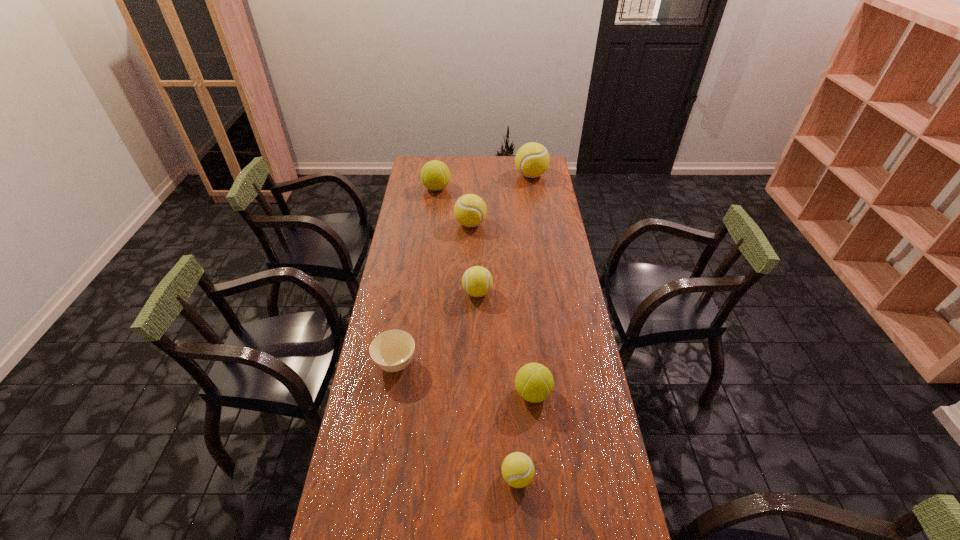
You are a GUI agent. You are given a task and a screenshot of the screen. Output one action in this format:
    pyautogui.click(x=<x>, y=<y>)
    Task: Click on the sugar bowl
    This screenshot has width=960, height=540.
    Given the screenshot: What is the action you would take?
    pyautogui.click(x=392, y=351)

Locate an element on the screen. The image size is (960, 540). the smallest yellow tennis ball is located at coordinates (518, 470).

Where is `the nearest object`? The width and height of the screenshot is (960, 540). the nearest object is located at coordinates (518, 470).

You are a GUI agent. You are given a task and a screenshot of the screen. Output one action in this format:
    pyautogui.click(x=<x>, y=<y>)
    Task: Click on the vacant space located 0.300m on the left of the tallest tennis ball
    The height and width of the screenshot is (540, 960).
    Given the screenshot: What is the action you would take?
    pyautogui.click(x=458, y=175)

Where is `free region located on the front of the third nearest yellow tennis ball`? free region located on the front of the third nearest yellow tennis ball is located at coordinates tap(469, 273).

Identify the location of vacant space located on the right of the bigger green tennis ball. tap(512, 188).

This screenshot has height=540, width=960. I want to click on vacant space located on the front of the third biggest yellow tennis ball, so click(x=477, y=337).

Locate an element on the screen. The height and width of the screenshot is (540, 960). free space located on the left of the smaller green tennis ball is located at coordinates (411, 393).

Find the location of a particular element. The image size is (960, 540). blank area located on the right of the sugar bowl is located at coordinates (468, 363).

At what (x,y) coordinates should I click in order to perform the action: click on vacant point located on the back of the shortest tennis ball. Please return your answer as a coordinate pair (x, y). This screenshot has height=540, width=960. Looking at the image, I should click on (512, 393).